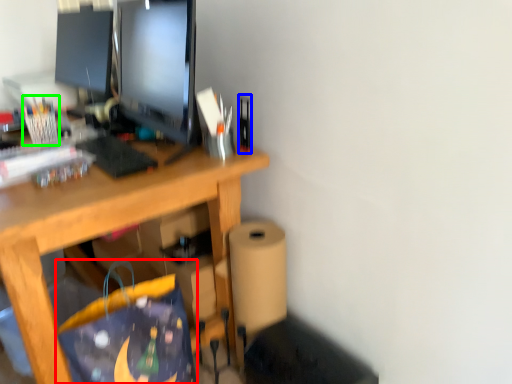
Question: Considering the real-world distances, which object is farthest from shopping bag (highlighted by a red box)? stationery (highlighted by a blue box) or stationery (highlighted by a green box)?

Choices:
 (A) stationery
 (B) stationery

Answer: (B)